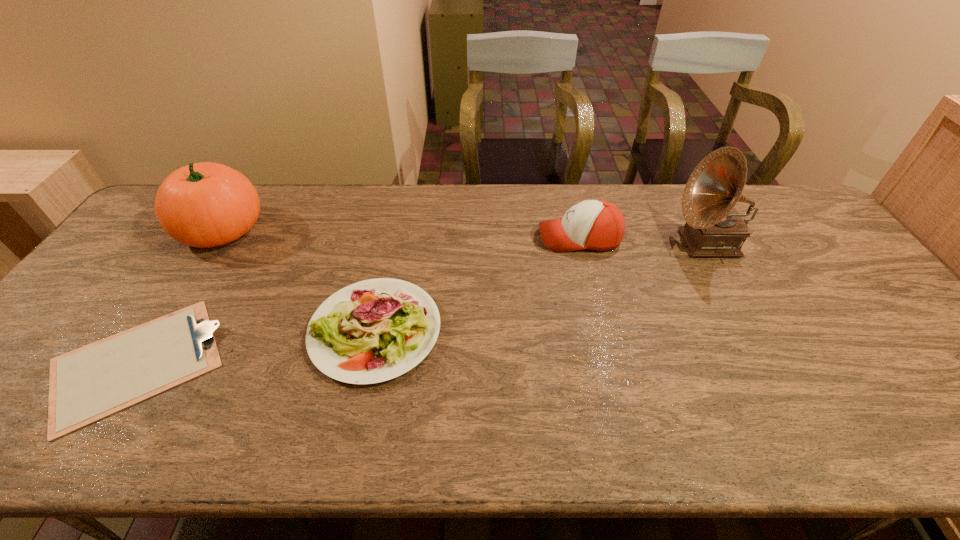
Identify the location of the tallest object. The image size is (960, 540). (713, 228).

This screenshot has height=540, width=960. Identify the location of the rightmost object. (713, 228).

What are the coordinates of `the fourth shortest object` in the screenshot? It's located at (205, 204).

What are the coordinates of `the second object from right to left` in the screenshot? It's located at (598, 225).

The height and width of the screenshot is (540, 960). I want to click on baseball cap, so pos(598,225).

I want to click on the fourth tallest object, so click(371, 331).

The image size is (960, 540). What are the coordinates of `salad plate` in the screenshot? It's located at (371, 331).

You are a GUI agent. You are given a task and a screenshot of the screen. Output one action in this format:
    pyautogui.click(x=<x>, y=<y>)
    Task: Click on the vacant space situated on the horn of the tallest object
    The width and height of the screenshot is (960, 540).
    Given the screenshot: What is the action you would take?
    pyautogui.click(x=573, y=243)

Identify the location of vacant region located on the horn of the tallest object. (592, 243).

What are the coordinates of `vacant space situated 0.360m on the horn of the tallest object` in the screenshot? It's located at (557, 243).